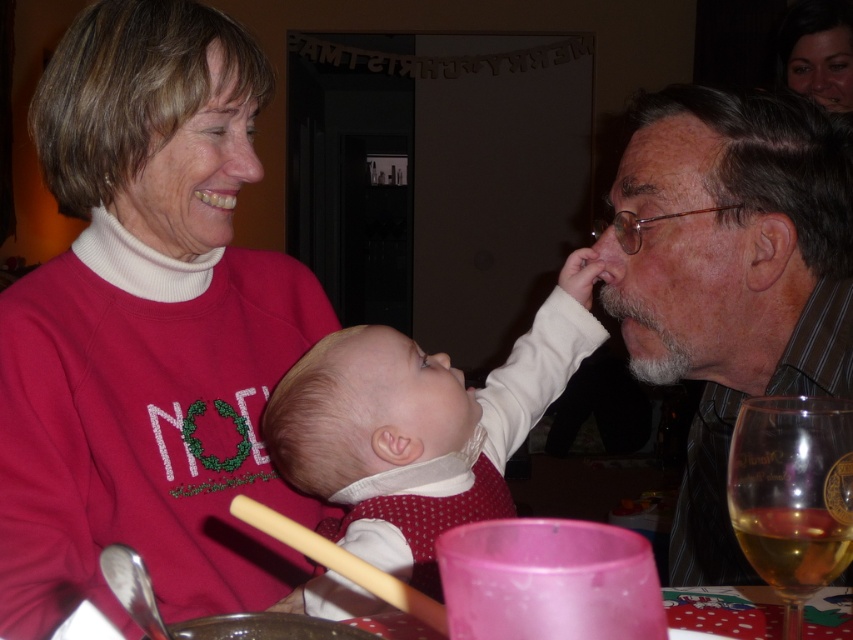
Where is the white soft baby at center located in the image?

The white soft baby at center is located at point coordinates of 0.664 on the x axis and 0.495 on the y axis.

You are a photographer trying to capture a closeup of the smooth skin face at upper right and the wooden chopstick at lower center. Based on their sizes, which object should you focus on first to ensure it appears larger in the photo?

The smooth skin face at upper right is taller than the wooden chopstick at lower center, so you should focus on the smooth skin face at upper right first to ensure it appears larger in the photo.

You are taking a photo of the scene. You want to focus on the point that is closer to you. Which point should you choose between point (799, 595) and point (413, 611)?

Point (413, 611) is closer to you than point (799, 595), so you should choose point (413, 611) to focus on.